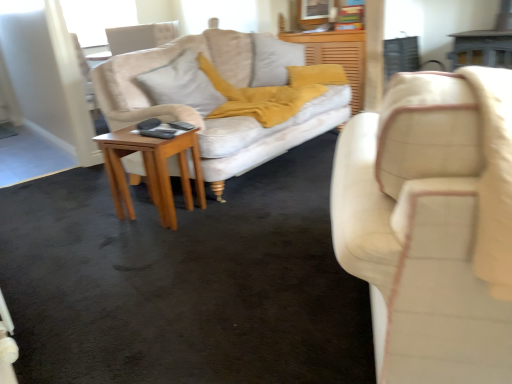
Question: Is light brown wooden side table at center bigger than matte cream studio couch at right?

Choices:
 (A) yes
 (B) no

Answer: (B)

Question: Can you confirm if light brown wooden side table at center is shorter than matte cream studio couch at right?

Choices:
 (A) yes
 (B) no

Answer: (A)

Question: Considering the relative sizes of light brown wooden side table at center and matte cream studio couch at right in the image provided, is light brown wooden side table at center thinner than matte cream studio couch at right?

Choices:
 (A) no
 (B) yes

Answer: (B)

Question: Is matte cream studio couch at right surrounded by light brown wooden side table at center?

Choices:
 (A) yes
 (B) no

Answer: (B)

Question: From a real-world perspective, is light brown wooden side table at center located higher than matte cream studio couch at right?

Choices:
 (A) no
 (B) yes

Answer: (A)

Question: From the image's perspective, is light brown wooden side table at center located above or below light gray fabric pillow at center?

Choices:
 (A) above
 (B) below

Answer: (B)

Question: Is point (111, 162) closer or farther from the camera than point (218, 97)?

Choices:
 (A) farther
 (B) closer

Answer: (B)

Question: Which is correct: light brown wooden side table at center is inside light gray fabric pillow at center, or outside of it?

Choices:
 (A) outside
 (B) inside

Answer: (A)

Question: Considering the positions of light brown wooden side table at center and light gray fabric pillow at center in the image, is light brown wooden side table at center wider or thinner than light gray fabric pillow at center?

Choices:
 (A) wide
 (B) thin

Answer: (A)

Question: From the image's perspective, relative to light brown wooden side table at center, is light gray fabric pillow at center above or below?

Choices:
 (A) below
 (B) above

Answer: (B)

Question: Considering the positions of light gray fabric pillow at center and light brown wooden side table at center in the image, is light gray fabric pillow at center wider or thinner than light brown wooden side table at center?

Choices:
 (A) thin
 (B) wide

Answer: (A)

Question: From their relative heights in the image, would you say light gray fabric pillow at center is taller or shorter than light brown wooden side table at center?

Choices:
 (A) tall
 (B) short

Answer: (B)

Question: Is point (181, 96) positioned closer to the camera than point (116, 183)?

Choices:
 (A) farther
 (B) closer

Answer: (A)

Question: Is light brown wooden side table at center wider or thinner than matte cream studio couch at right?

Choices:
 (A) wide
 (B) thin

Answer: (B)

Question: Would you say light brown wooden side table at center is inside or outside matte cream studio couch at right?

Choices:
 (A) outside
 (B) inside

Answer: (A)